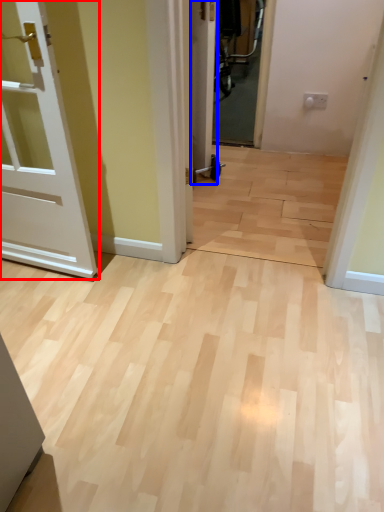
Question: Which of the following is the farthest to the observer, door (highlighted by a red box) or door (highlighted by a blue box)?

Choices:
 (A) door
 (B) door

Answer: (B)